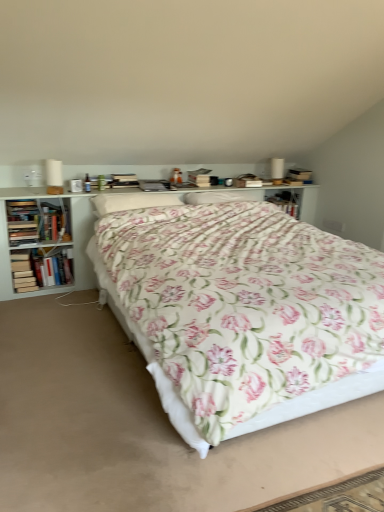
Question: Is white soft pillow at center behind hardcover book at left, which is the 1th book from top to bottom?

Choices:
 (A) no
 (B) yes

Answer: (A)

Question: Does white soft pillow at center have a lesser height compared to hardcover book at left, arranged as the 3th book when ordered from the bottom?

Choices:
 (A) yes
 (B) no

Answer: (A)

Question: From the image's perspective, is white soft pillow at center located beneath hardcover book at left, arranged as the 3th book when ordered from the bottom?

Choices:
 (A) no
 (B) yes

Answer: (A)

Question: Is white soft pillow at center facing towards hardcover book at left, arranged as the 3th book when ordered from the bottom?

Choices:
 (A) yes
 (B) no

Answer: (B)

Question: Is white soft pillow at center far away from hardcover book at left, arranged as the 3th book when ordered from the bottom?

Choices:
 (A) yes
 (B) no

Answer: (B)

Question: Does white soft pillow at center have a smaller size compared to hardcover book at left, which is the 1th book from top to bottom?

Choices:
 (A) yes
 (B) no

Answer: (B)

Question: Is hardcover book at left, which is counted as the 3th book, starting from the top, thinner than floral fabric bed at center?

Choices:
 (A) yes
 (B) no

Answer: (A)

Question: Can you confirm if hardcover book at left, the first book in the bottom-to-top sequence, is positioned to the right of floral fabric bed at center?

Choices:
 (A) no
 (B) yes

Answer: (A)

Question: Is hardcover book at left, the first book in the bottom-to-top sequence, next to floral fabric bed at center and touching it?

Choices:
 (A) no
 (B) yes

Answer: (A)

Question: Is hardcover book at left, which is counted as the 3th book, starting from the top, closer to camera compared to floral fabric bed at center?

Choices:
 (A) no
 (B) yes

Answer: (A)

Question: From the image's perspective, is hardcover book at left, the first book in the bottom-to-top sequence, below floral fabric bed at center?

Choices:
 (A) no
 (B) yes

Answer: (A)

Question: Does hardcover book at left, the first book in the bottom-to-top sequence, appear on the left side of floral fabric bed at center?

Choices:
 (A) yes
 (B) no

Answer: (A)

Question: Could hardcover book at left, the first book in the bottom-to-top sequence, be considered to be inside hardcover book at left, the second book viewed from the top?

Choices:
 (A) yes
 (B) no

Answer: (B)